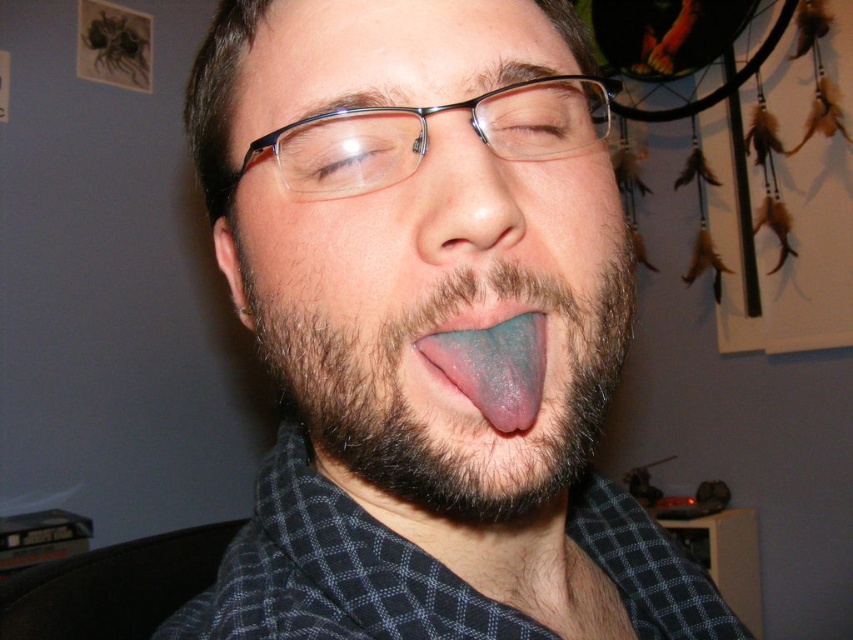
Question: Which is nearer to the matte blue tongue at center?

Choices:
 (A) dark brown fuzzy beard at center
 (B) blue glossy tongue at center

Answer: (A)

Question: Can you confirm if dark brown fuzzy beard at center is positioned above blue glossy tongue at center?

Choices:
 (A) yes
 (B) no

Answer: (B)

Question: Where is matte blue tongue at center located in relation to dark brown fuzzy beard at center in the image?

Choices:
 (A) left
 (B) right

Answer: (B)

Question: Does matte blue tongue at center have a smaller size compared to dark brown fuzzy beard at center?

Choices:
 (A) yes
 (B) no

Answer: (B)

Question: Considering the real-world distances, which object is farthest from the dark brown fuzzy beard at center?

Choices:
 (A) matte blue tongue at center
 (B) blue glossy tongue at center

Answer: (B)

Question: Which object is farther from the camera taking this photo?

Choices:
 (A) matte blue tongue at center
 (B) blue glossy tongue at center
 (C) dark brown fuzzy beard at center

Answer: (B)